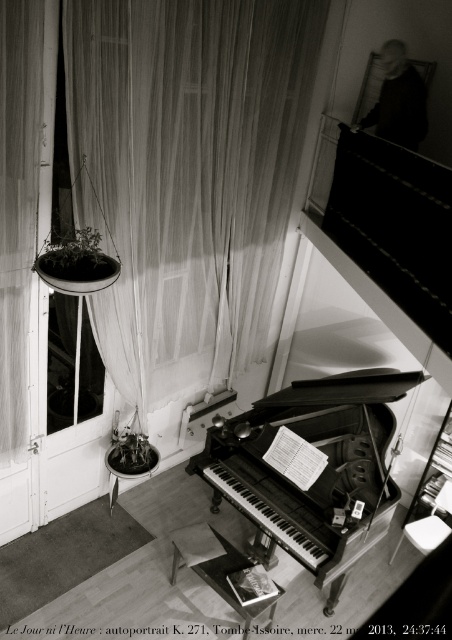
Is black polished piano at center to the right of transparent glass window at center from the viewer's perspective?

Indeed, black polished piano at center is positioned on the right side of transparent glass window at center.

In order to click on black polished piano at center in this screenshot , I will do `click(320, 474)`.

Between point (14, 108) and point (75, 307), which one is positioned behind?

Point (75, 307)

Between point (219, 340) and point (84, 304), which one is positioned behind?

The point (219, 340) is more distant.

The width and height of the screenshot is (452, 640). Find the location of `translucent fabric curtain at upper center`. translucent fabric curtain at upper center is located at coordinates (187, 173).

Which of these two, translucent fabric curtain at upper center or black polished piano at center, stands taller?

With more height is translucent fabric curtain at upper center.

At what (x,y) coordinates should I click in order to perform the action: click on translucent fabric curtain at upper center. Please return your answer as a coordinate pair (x, y). The height and width of the screenshot is (640, 452). Looking at the image, I should click on (187, 173).